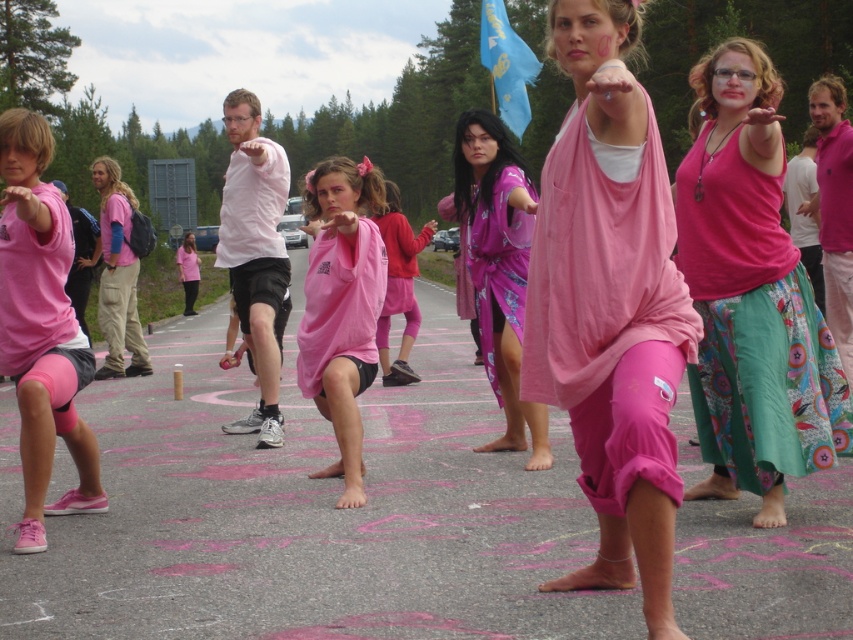
You are a photographer positioned at the edge of the road. You need to capture a photo that includes both the pink fabric at center and the matte pink shirt at center. Given that your camera has a maximum focus range of 7 feet, will you be able to capture both objects clearly in the same frame?

The distance between the pink fabric at center and the matte pink shirt at center is 7.60 feet. Since the camera can only focus within 7 feet, the objects are slightly out of the focus range. Therefore, you might not be able to capture both clearly in the same frame.

You are a photographer trying to capture the best shot of the two pink fabrics in the scene. Since you want them both in the frame, which direction should you position yourself relative to the pink fabric skirt at center to ensure the pink fabric at center is also visible?

To capture both the pink fabric at center and the pink fabric skirt at center in the frame, you should position yourself to the left of the pink fabric skirt at center. This way, the pink fabric at center, which is to the left of the skirt, will also be visible in your shot.

You are a photographer standing at the edge of the road. You want to capture a photo that includes both the pink fabric at center and the pink fabric skirt at center. Which one will appear larger in the photo?

The pink fabric at center will appear larger in the photo because it is closer to the viewer than the pink fabric skirt at center.